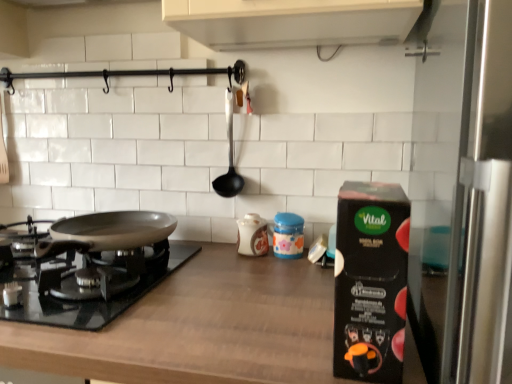
This screenshot has width=512, height=384. Identify the location of vacant area that lies between silver metallic pan at lower left and matte ceramic jar at center, placed as the 3th kitchen appliance when sorted from right to left. (201, 272).